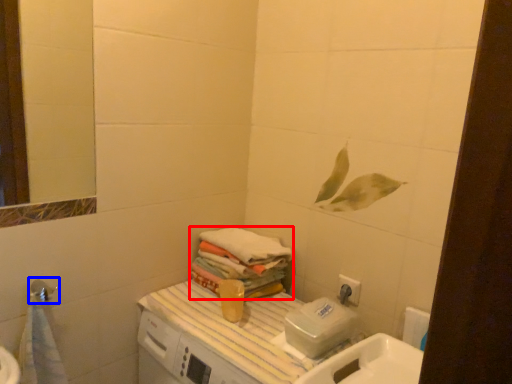
Question: Which object is further to the camera taking this photo, bath towel (highlighted by a red box) or shower (highlighted by a blue box)?

Choices:
 (A) bath towel
 (B) shower

Answer: (A)